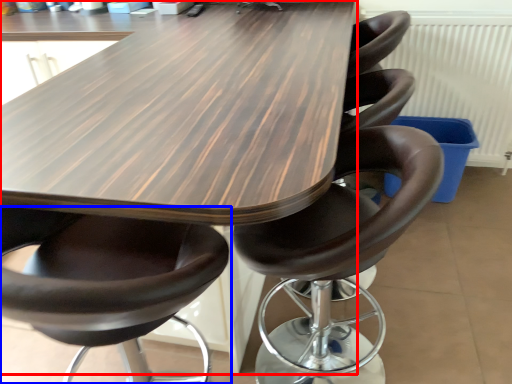
Question: Among these objects, which one is nearest to the camera, table (highlighted by a red box) or chair (highlighted by a blue box)?

Choices:
 (A) table
 (B) chair

Answer: (B)